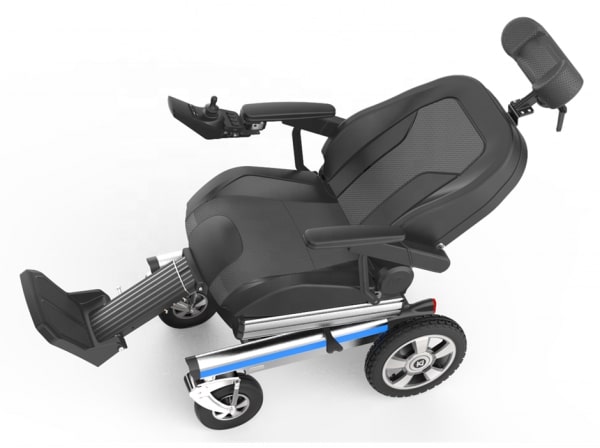
I want to click on footrest, so click(67, 317).